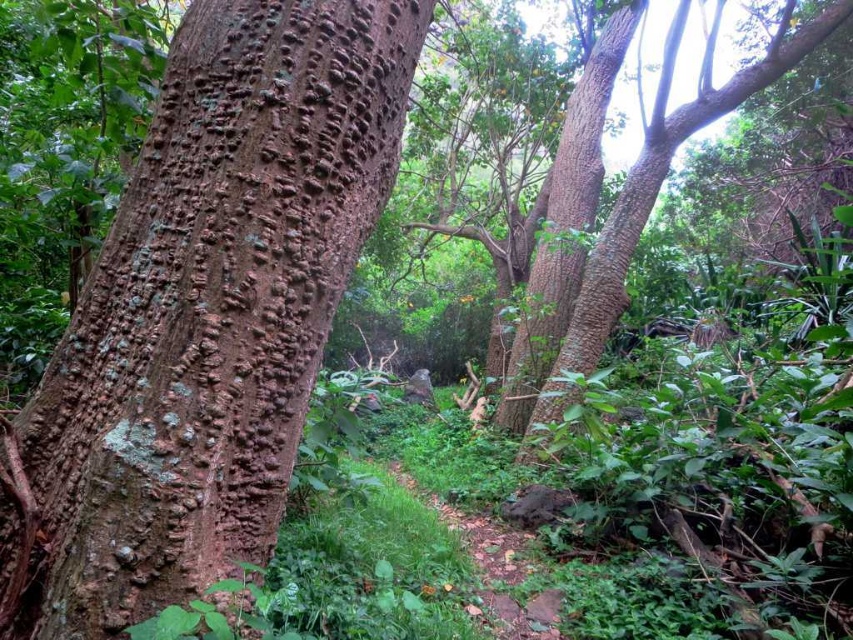
Question: Does brown rough bark at center have a lesser width compared to smooth brown tree trunk at upper right?

Choices:
 (A) no
 (B) yes

Answer: (B)

Question: Is brown rough bark at center positioned behind smooth brown tree trunk at upper center?

Choices:
 (A) no
 (B) yes

Answer: (A)

Question: Which point appears closest to the camera in this image?

Choices:
 (A) (502, 397)
 (B) (102, 540)

Answer: (B)

Question: Which point is farther to the camera?

Choices:
 (A) brown rough bark at center
 (B) smooth brown tree trunk at upper right
 (C) smooth brown tree trunk at upper center

Answer: (C)

Question: Where is brown rough bark at center located in relation to smooth brown tree trunk at upper right in the image?

Choices:
 (A) right
 (B) left

Answer: (B)

Question: Among these points, which one is nearest to the camera?

Choices:
 (A) (786, 4)
 (B) (155, 365)

Answer: (B)